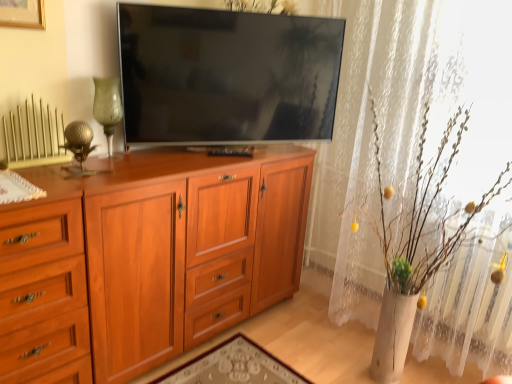
This screenshot has width=512, height=384. What do you see at coordinates (42, 293) in the screenshot?
I see `light brown wood drawer at left` at bounding box center [42, 293].

Locate an element on the screen. This screenshot has width=512, height=384. white lace curtain at upper right is located at coordinates (404, 125).

Where is `flat screen tv at center`? Image resolution: width=512 pixels, height=384 pixels. flat screen tv at center is located at coordinates (227, 75).

Identify the location of light brown wood cabinet at center. (167, 247).

Identify the location of gold metallic radiator at upper left. The width and height of the screenshot is (512, 384). (33, 135).

Based on the photo, from a real-world perspective, relative to gold metallic radiator at upper left, is brushed gold picture frame at upper left vertically above or below?

brushed gold picture frame at upper left is situated higher than gold metallic radiator at upper left in the real world.

Locate an element on the screen. radiator behind the brushed gold picture frame at upper left is located at coordinates (33, 135).

Is the position of brushed gold picture frame at upper left less distant than that of gold metallic radiator at upper left?

That is True.

Is brushed gold picture frame at upper left spatially inside gold metallic radiator at upper left, or outside of it?

brushed gold picture frame at upper left exists outside the volume of gold metallic radiator at upper left.

Between brushed gold picture frame at upper left and white lace curtain at upper right, which one has more height?

white lace curtain at upper right is taller.

Considering the points (7, 23) and (407, 69), which point is behind, point (7, 23) or point (407, 69)?

Positioned behind is point (407, 69).

Does brushed gold picture frame at upper left touch white lace curtain at upper right?

brushed gold picture frame at upper left is not next to white lace curtain at upper right, and they're not touching.

Between brushed gold picture frame at upper left and light brown wood drawer at left, which one appears on the left side from the viewer's perspective?

brushed gold picture frame at upper left.

Looking at their sizes, would you say brushed gold picture frame at upper left is wider or thinner than light brown wood drawer at left?

brushed gold picture frame at upper left is thinner than light brown wood drawer at left.

From the image's perspective, between brushed gold picture frame at upper left and light brown wood drawer at left, which one is located above?

brushed gold picture frame at upper left, from the image's perspective.

Is brushed gold picture frame at upper left next to light brown wood drawer at left and touching it?

brushed gold picture frame at upper left is not next to light brown wood drawer at left, and they're not touching.

Is flat screen tv at center wider or thinner than gold metallic radiator at upper left?

Considering their sizes, flat screen tv at center looks broader than gold metallic radiator at upper left.

How different are the orientations of flat screen tv at center and gold metallic radiator at upper left in degrees?

The angle between the facing direction of flat screen tv at center and the facing direction of gold metallic radiator at upper left is 29 degrees.

Looking at this image, from the image's perspective, who appears lower, flat screen tv at center or gold metallic radiator at upper left?

From the image's view, gold metallic radiator at upper left is below.

Is flat screen tv at center in front of gold metallic radiator at upper left?

No, flat screen tv at center is further to the viewer.

Which is more to the right, gold metallic radiator at upper left or white lace curtain at upper right?

Positioned to the right is white lace curtain at upper right.

This screenshot has width=512, height=384. I want to click on radiator that appears on the left of white lace curtain at upper right, so [x=33, y=135].

Considering the points (297, 103) and (61, 309), which point is in front, point (297, 103) or point (61, 309)?

Point (61, 309)

Is flat screen tv at center wider or thinner than light brown wood drawer at left?

Clearly, flat screen tv at center has less width compared to light brown wood drawer at left.

From a real-world perspective, is flat screen tv at center located higher than light brown wood drawer at left?

Yes, from a real-world perspective, flat screen tv at center is over light brown wood drawer at left

Does point (38, 302) lie behind point (170, 129)?

No, (38, 302) is in front of (170, 129).

From a real-world perspective, which is physically below, light brown wood drawer at left or flat screen tv at center?

light brown wood drawer at left.

Looking at this image, does light brown wood drawer at left have a lesser height compared to flat screen tv at center?

Incorrect, the height of light brown wood drawer at left does not fall short of that of flat screen tv at center.

Would you say light brown wood drawer at left is outside flat screen tv at center?

Yes, light brown wood drawer at left is outside of flat screen tv at center.

This screenshot has width=512, height=384. I want to click on picture frame lying on the left of gold metallic radiator at upper left, so click(x=22, y=13).

Where is `picture frame above the white lace curtain at upper right (from the image's perspective)`? The width and height of the screenshot is (512, 384). picture frame above the white lace curtain at upper right (from the image's perspective) is located at coordinates (22, 13).

Looking at the image, which one is located further to light brown wood cabinet at center, gold metallic radiator at upper left or brushed gold picture frame at upper left?

The object further to light brown wood cabinet at center is brushed gold picture frame at upper left.

From the image, which object appears to be farther from flat screen tv at center, white lace curtain at upper right or light brown wood drawer at left?

light brown wood drawer at left is positioned further to the anchor flat screen tv at center.

Estimate the real-world distances between objects in this image. Which object is closer to light brown wood drawer at left, light brown wood cabinet at center or brushed gold picture frame at upper left?

Based on the image, light brown wood cabinet at center appears to be nearer to light brown wood drawer at left.

When comparing their distances from gold metallic radiator at upper left, does white lace curtain at upper right or light brown wood drawer at left seem closer?

Among the two, light brown wood drawer at left is located nearer to gold metallic radiator at upper left.

Which object lies nearer to the anchor point light brown wood drawer at left, brushed gold picture frame at upper left or gold metallic radiator at upper left?

Among the two, gold metallic radiator at upper left is located nearer to light brown wood drawer at left.

Estimate the real-world distances between objects in this image. Which object is further from gold metallic radiator at upper left, brushed gold picture frame at upper left or light brown wood drawer at left?

Based on the image, light brown wood drawer at left appears to be further to gold metallic radiator at upper left.

Considering their positions, is light brown wood drawer at left positioned closer to brushed gold picture frame at upper left than white lace curtain at upper right?

light brown wood drawer at left.

From the image, which object appears to be nearer to flat screen tv at center, brushed gold picture frame at upper left or light brown wood drawer at left?

brushed gold picture frame at upper left is closer to flat screen tv at center.

Image resolution: width=512 pixels, height=384 pixels. In order to click on cabinetry between brushed gold picture frame at upper left and light brown wood drawer at left from top to bottom in this screenshot , I will do `click(167, 247)`.

Locate an element on the screen. The height and width of the screenshot is (384, 512). television between brushed gold picture frame at upper left and light brown wood cabinet at center from top to bottom is located at coordinates (227, 75).

At what (x,y) coordinates should I click in order to perform the action: click on radiator between flat screen tv at center and light brown wood drawer at left from top to bottom. Please return your answer as a coordinate pair (x, y). This screenshot has height=384, width=512. Looking at the image, I should click on (33, 135).

The width and height of the screenshot is (512, 384). Identify the location of cabinetry between brushed gold picture frame at upper left and white lace curtain at upper right from left to right. (167, 247).